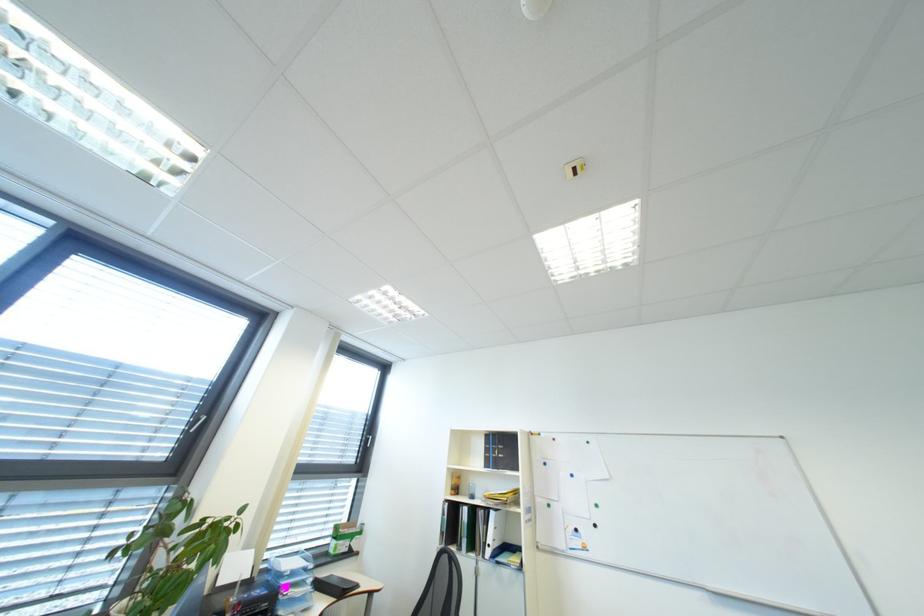
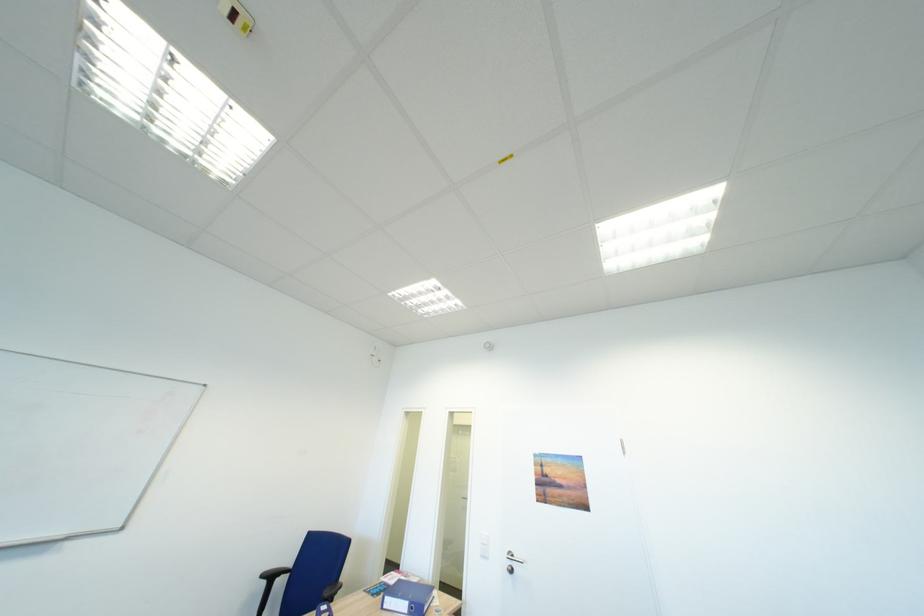
The images are taken continuously from a first-person perspective. In which direction is your viewpoint rotating?

The rotation direction of the camera is right-up.